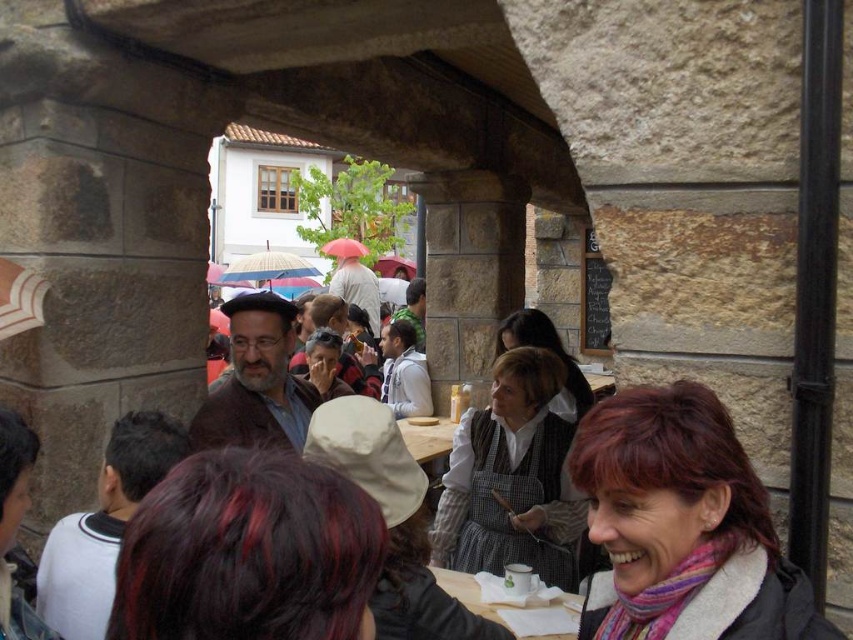
You are a customer at the cafe and see both the multicolored scarf at lower right and the white cotton apron at center. Which item is positioned more to the east side of the scene?

The multicolored scarf at lower right is to the right of white cotton apron at center, so the multicolored scarf at lower right is positioned more to the east side of the scene.

You are standing at the entrance of the archway and want to find the person with dark red hair at center. According to the coordinates given, in which direction should you look to locate them?

The dark red hair at center is located at coordinates point (x=248, y=552). Since the x coordinate is 0.864, which is closer to the right edge, and the y coordinate is 0.292, closer to the bottom, you should look to the lower right direction to locate them.